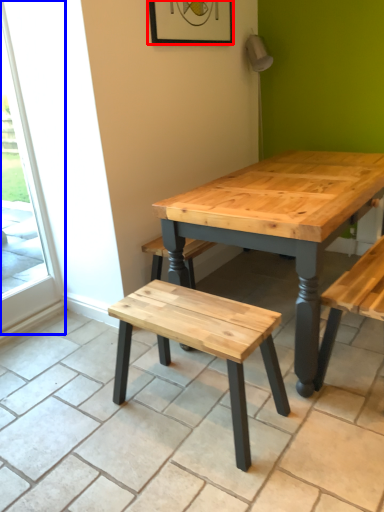
Question: Which point is further to the camera, picture frame (highlighted by a red box) or screen door (highlighted by a blue box)?

Choices:
 (A) picture frame
 (B) screen door

Answer: (A)